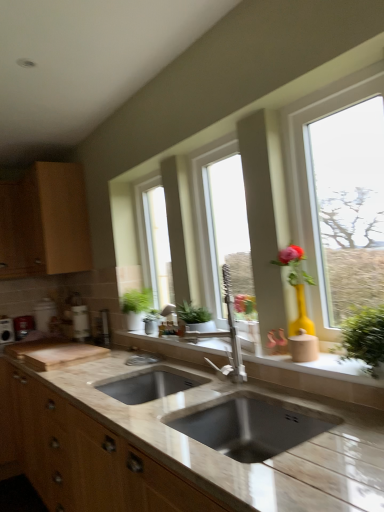
Question: Can wooden cabinet at left be found inside green matte plant at center, positioned as the third window in right-to-left order?

Choices:
 (A) yes
 (B) no

Answer: (B)

Question: Is green matte plant at center, the first window in the left-to-right sequence, further to camera compared to wooden cabinet at left?

Choices:
 (A) no
 (B) yes

Answer: (A)

Question: Can you confirm if green matte plant at center, arranged as the 1th window when viewed from the back, is smaller than wooden cabinet at left?

Choices:
 (A) no
 (B) yes

Answer: (B)

Question: Could you tell me if green matte plant at center, arranged as the 1th window when viewed from the back, is turned towards wooden cabinet at left?

Choices:
 (A) no
 (B) yes

Answer: (A)

Question: Can you confirm if green matte plant at center, the first window in the left-to-right sequence, is bigger than wooden cabinet at left?

Choices:
 (A) yes
 (B) no

Answer: (B)

Question: From the image's perspective, would you say green matte plant at center, the first window in the left-to-right sequence, is shown under wooden cabinet at left?

Choices:
 (A) no
 (B) yes

Answer: (B)

Question: Does clear glass window at center, which ranks as the second window in left-to-right order, have a greater height compared to metallic silver toaster at left, which is counted as the 1th appliance, starting from the right?

Choices:
 (A) yes
 (B) no

Answer: (A)

Question: Does clear glass window at center, which appears as the second window when viewed from the right, have a smaller size compared to metallic silver toaster at left, which is counted as the 1th appliance, starting from the right?

Choices:
 (A) no
 (B) yes

Answer: (A)

Question: Can you confirm if clear glass window at center, marked as the 2th window in a back-to-front arrangement, is bigger than metallic silver toaster at left, which ranks as the second appliance in left-to-right order?

Choices:
 (A) no
 (B) yes

Answer: (B)

Question: Is clear glass window at center, which ranks as the second window in left-to-right order, not within metallic silver toaster at left, which ranks as the second appliance in left-to-right order?

Choices:
 (A) no
 (B) yes

Answer: (B)

Question: From a real-world perspective, is clear glass window at center, which ranks as the second window in left-to-right order, on metallic silver toaster at left, which is counted as the 1th appliance, starting from the right?

Choices:
 (A) no
 (B) yes

Answer: (B)

Question: Can you confirm if clear glass window at center, the 2th window when ordered from front to back, is thinner than metallic silver toaster at left, which ranks as the second appliance in left-to-right order?

Choices:
 (A) yes
 (B) no

Answer: (A)

Question: Would you say beige stone sink at center is a long distance from clear glass window at center, which ranks as the second window in left-to-right order?

Choices:
 (A) yes
 (B) no

Answer: (B)